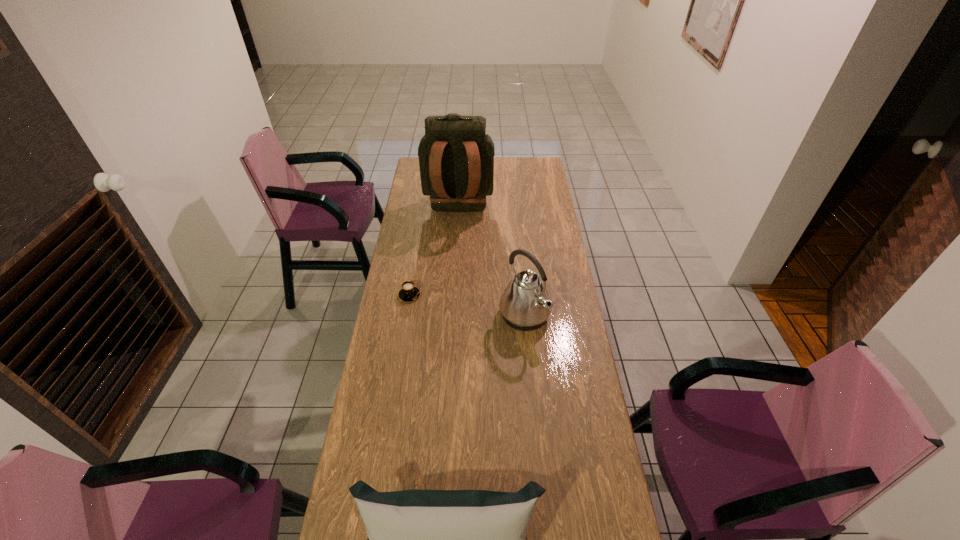
What are the coordinates of `vacant point at the far edge` in the screenshot? It's located at coord(510,164).

The image size is (960, 540). In order to click on free spot at the left edge of the desktop in this screenshot , I will do `click(418, 252)`.

Find the location of `vacant point at the right edge`. vacant point at the right edge is located at coordinates (560, 299).

Where is `free space between the farthest object and the cappuccino`? This screenshot has height=540, width=960. free space between the farthest object and the cappuccino is located at coordinates (434, 253).

Locate an element on the screen. This screenshot has width=960, height=540. free space between the third shortest object and the cappuccino is located at coordinates (467, 306).

Find the location of a particular element. This screenshot has width=960, height=540. vacant area between the shortest object and the tallest object is located at coordinates (434, 253).

At what (x,y) coordinates should I click in order to perform the action: click on vacant point located between the shortest object and the tallest object. Please return your answer as a coordinate pair (x, y). Looking at the image, I should click on (434, 253).

Find the location of `unoccupied area between the farthest object and the kettle`. unoccupied area between the farthest object and the kettle is located at coordinates (492, 264).

Locate which object ranks in proximity to the third shortest object. Please provide its 2D coordinates. Your answer should be formatted as a tuple, i.e. [(x, y)], where the tuple contains the x and y coordinates of a point satisfying the conditions above.

[(408, 293)]

Find the location of `the second closest object to the shortest object`. the second closest object to the shortest object is located at coordinates (456, 157).